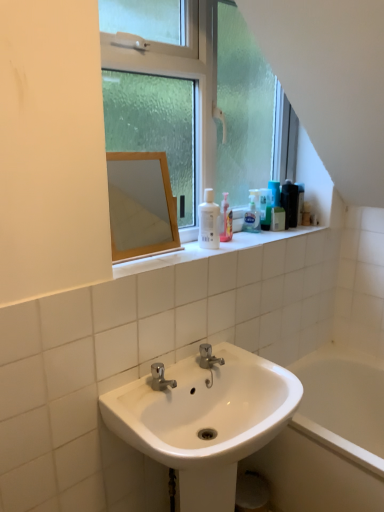
Question: Is black plastic mouthwash at upper right, the first mouthwash in the back-to-front sequence, facing away from green matte bottle at upper right, the 3th mouthwash when ordered from right to left?

Choices:
 (A) yes
 (B) no

Answer: (B)

Question: Are black plastic mouthwash at upper right, which is the 1th mouthwash from right to left, and green matte bottle at upper right, the 3th mouthwash when ordered from right to left, located far from each other?

Choices:
 (A) no
 (B) yes

Answer: (A)

Question: Can you confirm if black plastic mouthwash at upper right, which is the fifth mouthwash in front-to-back order, is shorter than green matte bottle at upper right, which is counted as the 4th mouthwash, starting from the back?

Choices:
 (A) no
 (B) yes

Answer: (A)

Question: Does black plastic mouthwash at upper right, which is the 1th mouthwash from right to left, appear on the left side of green matte bottle at upper right, the 3th mouthwash when ordered from right to left?

Choices:
 (A) no
 (B) yes

Answer: (A)

Question: Is black plastic mouthwash at upper right, which is the fifth mouthwash in front-to-back order, positioned behind green matte bottle at upper right, the 3th mouthwash in the left-to-right sequence?

Choices:
 (A) yes
 (B) no

Answer: (A)

Question: In terms of height, does white glossy sink at lower center look taller or shorter compared to green matte bottle at upper right, the 3th mouthwash when ordered from right to left?

Choices:
 (A) short
 (B) tall

Answer: (B)

Question: Based on their sizes in the image, would you say white glossy sink at lower center is bigger or smaller than green matte bottle at upper right, positioned as the second mouthwash in front-to-back order?

Choices:
 (A) small
 (B) big

Answer: (B)

Question: Is white glossy sink at lower center wider or thinner than green matte bottle at upper right, the 3th mouthwash when ordered from right to left?

Choices:
 (A) thin
 (B) wide

Answer: (B)

Question: Is white glossy sink at lower center spatially inside green matte bottle at upper right, which is counted as the 4th mouthwash, starting from the back, or outside of it?

Choices:
 (A) inside
 (B) outside

Answer: (B)

Question: Looking at the image, does white glossy sink at lower center seem bigger or smaller compared to black plastic mouthwash at upper right, which is the 1th mouthwash from right to left?

Choices:
 (A) big
 (B) small

Answer: (A)

Question: Would you say white glossy sink at lower center is inside or outside black plastic mouthwash at upper right, the 5th mouthwash viewed from the left?

Choices:
 (A) inside
 (B) outside

Answer: (B)

Question: From a real-world perspective, relative to black plastic mouthwash at upper right, which is the fifth mouthwash in front-to-back order, is white glossy sink at lower center vertically above or below?

Choices:
 (A) below
 (B) above

Answer: (A)

Question: From the image's perspective, is white glossy sink at lower center above or below black plastic mouthwash at upper right, the 5th mouthwash viewed from the left?

Choices:
 (A) above
 (B) below

Answer: (B)

Question: From the image's perspective, is black glossy bottle at upper right, the 4th mouthwash when ordered from front to back, located above or below white glossy bathtub at lower right?

Choices:
 (A) below
 (B) above

Answer: (B)

Question: Is black glossy bottle at upper right, which is counted as the 2th mouthwash, starting from the back, to the left or to the right of white glossy bathtub at lower right in the image?

Choices:
 (A) left
 (B) right

Answer: (A)